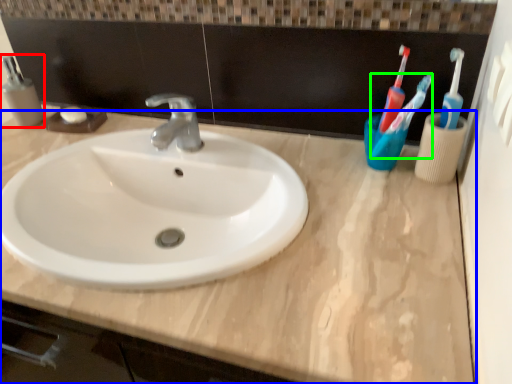
Question: Based on their relative distances, which object is nearer to mouthwash (highlighted by a red box)? Choose from counter top (highlighted by a blue box) and toothbrush (highlighted by a green box).

Choices:
 (A) counter top
 (B) toothbrush

Answer: (A)